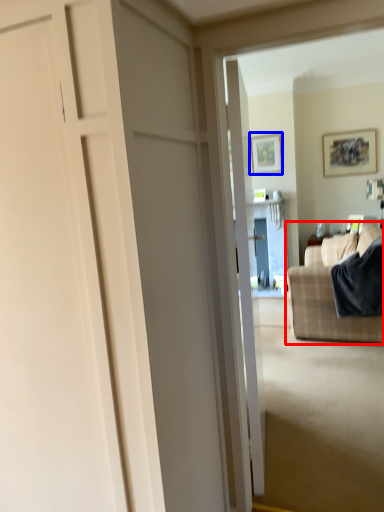
Question: Which of the following is the closest to the observer, studio couch (highlighted by a red box) or picture frame (highlighted by a blue box)?

Choices:
 (A) studio couch
 (B) picture frame

Answer: (A)